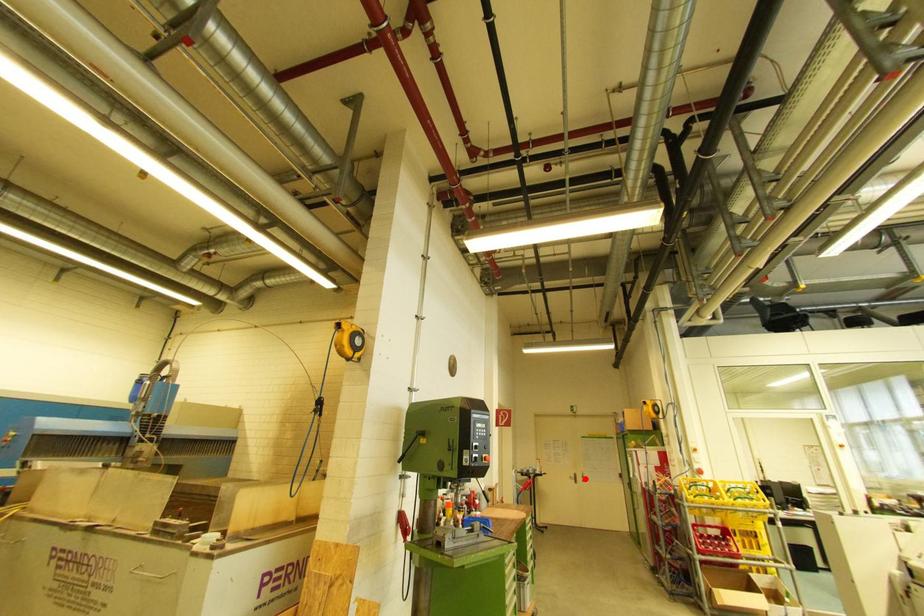
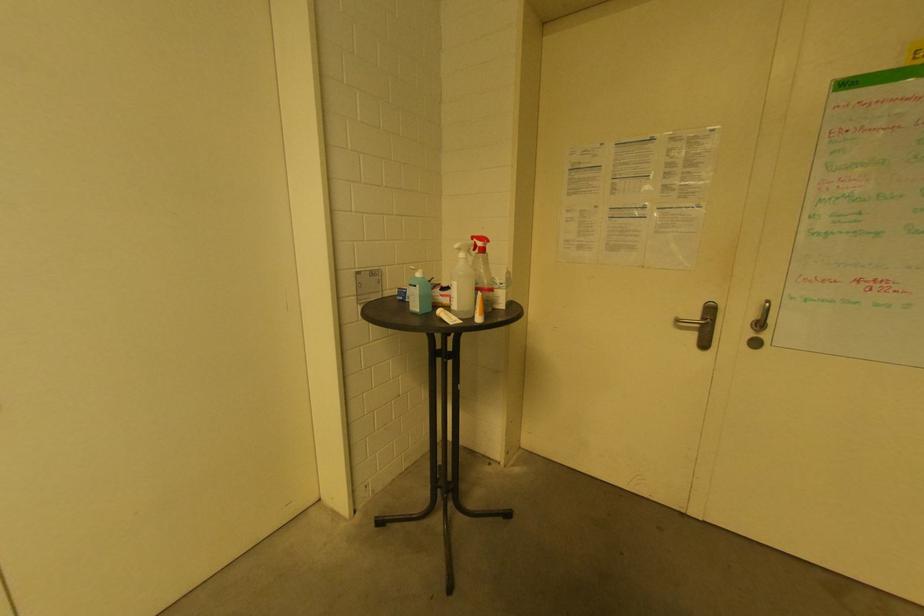
Where in the second image is the point corresponding to the highlighted location from the first image?

(761, 326)